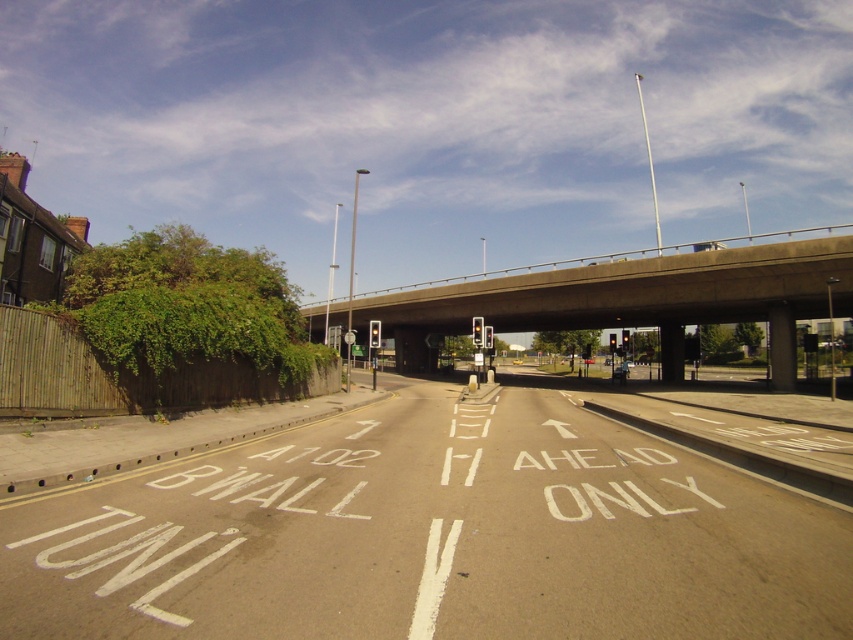
You are a delivery driver approaching the intersection and need to turn left. The point marked at coordinates (428, 536) on the road indicates the center of the intersection. Based on the road layout described, can you safely make a left turn from the left lane where the A702 B WALL TUN sign is located?

The point (428, 536) marks the white asphalt road at center, so turning left from the left lane with the A702 B WALL TUN sign may not be possible because left turns are typically not allowed from the leftmost lane marked for specific directions like A702 B WALL TUN which might indicate a through lane only. Check traffic signs for permitted maneuvers.

Looking at this image, you are driving a delivery truck and need to cross the intersection. You see the white asphalt road at center and the concrete bridge at center. Which one is closer to you?

The white asphalt road at center is closer to the viewer than the concrete bridge at center, so the white asphalt road at center is closer to you.

You are standing at the intersection and want to find the white asphalt road at center. According to the coordinates provided, where should you look to locate it?

The white asphalt road at center is located at coordinates point (x=428, y=536).